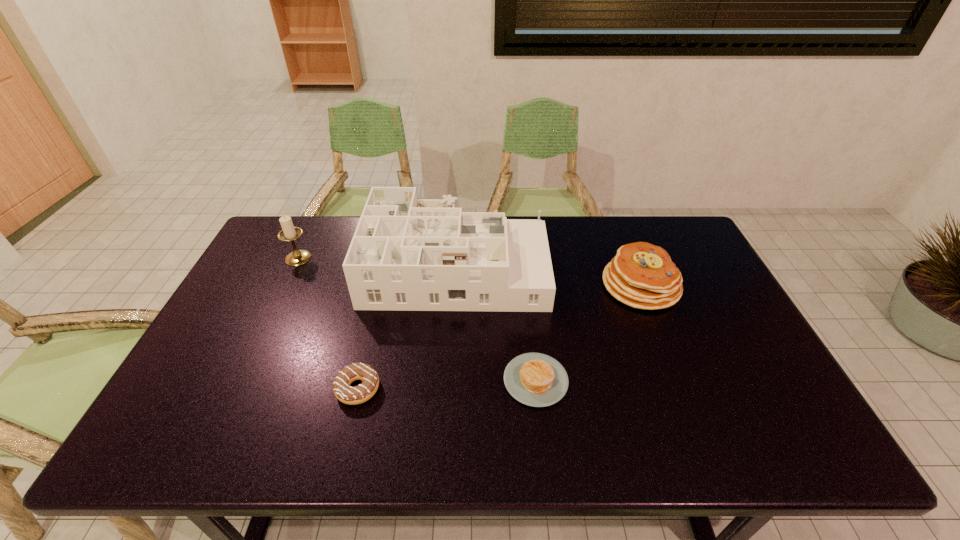
Identify the location of vacant space at the right edge of the desktop. (687, 259).

This screenshot has width=960, height=540. I want to click on vacant space at the far left corner of the desktop, so click(x=274, y=257).

Locate an element on the screen. free point between the left pancake and the candle holder is located at coordinates (417, 319).

Identify the location of empty location between the leftmost object and the doughnut. (328, 323).

In order to click on free space between the rightmost object and the doughnut in this screenshot , I will do `click(499, 337)`.

The height and width of the screenshot is (540, 960). I want to click on empty space that is in between the dollhouse and the doughnut, so click(407, 327).

Identify the location of free space between the doughnut and the candle holder. Image resolution: width=960 pixels, height=540 pixels. (328, 323).

Find the location of a particular element. vacant area that lies between the doughnut and the dollhouse is located at coordinates (407, 327).

Where is `vacant space that's between the taller pancake and the doughnut`? Image resolution: width=960 pixels, height=540 pixels. vacant space that's between the taller pancake and the doughnut is located at coordinates pos(499,337).

The width and height of the screenshot is (960, 540). In order to click on the second closest object to the leftmost object in this screenshot , I will do `click(343, 391)`.